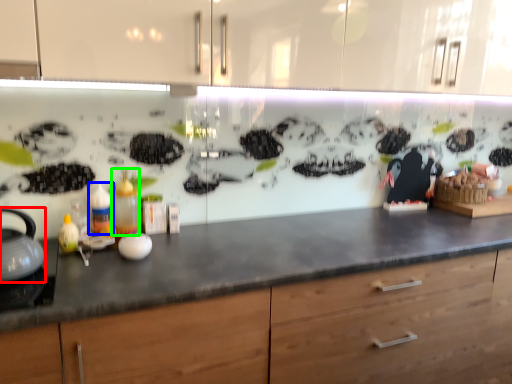
Question: Which is nearer to the tea pot (highlighted by a red box)? bottle (highlighted by a blue box) or bottle (highlighted by a green box).

Choices:
 (A) bottle
 (B) bottle

Answer: (A)